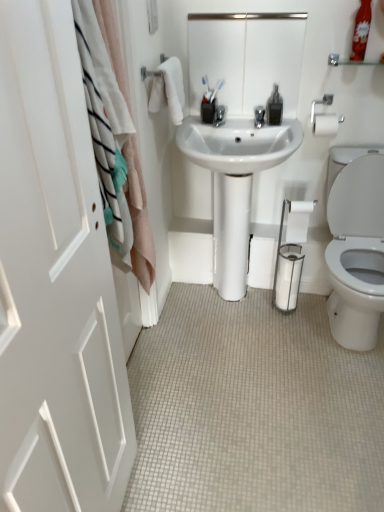
Identify the location of white tile floor at lower center. (253, 409).

This screenshot has height=512, width=384. Describe the element at coordinates (253, 409) in the screenshot. I see `white tile floor at lower center` at that location.

Image resolution: width=384 pixels, height=512 pixels. What do you see at coordinates (55, 282) in the screenshot?
I see `white matte door at left` at bounding box center [55, 282].

This screenshot has height=512, width=384. What do you see at coordinates (139, 218) in the screenshot?
I see `white fabric curtain at left` at bounding box center [139, 218].

The width and height of the screenshot is (384, 512). I want to click on white fabric curtain at left, so click(139, 218).

You are a GUI agent. You are given a task and a screenshot of the screen. Output one action in this format:
    pyautogui.click(x=<x>, y=<y>)
    Task: Click on the white paper roll at lower right
    This screenshot has height=512, width=384.
    Given the screenshot: What is the action you would take?
    pyautogui.click(x=298, y=220)

From a real-world perspective, is white tile floor at lower center under silver metallic towel bar at upper right?

Yes, from a real-world perspective, white tile floor at lower center is beneath silver metallic towel bar at upper right.

Does point (138, 448) appear closer or farther from the camera than point (319, 130)?

Point (138, 448).

Between white tile floor at lower center and silver metallic towel bar at upper right, which one is positioned behind?

silver metallic towel bar at upper right is further away from the camera.

Between white tile floor at lower center and silver metallic towel bar at upper right, which one has less height?

Standing shorter between the two is white tile floor at lower center.

Can you tell me how much white glossy sink at center and silver metallic towel bar at upper right differ in facing direction?

0.283 degrees.

Between white glossy sink at center and silver metallic towel bar at upper right, which one has less height?

Standing shorter between the two is silver metallic towel bar at upper right.

Which of these two, white glossy sink at center or silver metallic towel bar at upper right, is thinner?

Thinner between the two is silver metallic towel bar at upper right.

From a real-world perspective, is clear glass shelf at upper right positioned above or below white matte door at left?

Clearly, from a real-world perspective, clear glass shelf at upper right is above white matte door at left.

Looking at this image, visually, is clear glass shelf at upper right positioned to the left or to the right of white matte door at left?

clear glass shelf at upper right is to the right of white matte door at left.

From the image's perspective, is clear glass shelf at upper right located beneath white matte door at left?

No, from the image's perspective, clear glass shelf at upper right is not beneath white matte door at left.

Is clear glass shelf at upper right oriented away from white matte door at left?

That's not correct — clear glass shelf at upper right is not looking away from white matte door at left.

Is white matte door at left looking in the opposite direction of white fabric curtain at left?

No, white fabric curtain at left is not at the back of white matte door at left.

Can we say white matte door at left lies outside white fabric curtain at left?

That's correct, white matte door at left is outside of white fabric curtain at left.

From the picture: Considering the sizes of objects white matte door at left and white fabric curtain at left in the image provided, who is smaller, white matte door at left or white fabric curtain at left?

white fabric curtain at left is smaller.

Is white matte door at left beside white fabric curtain at left?

No.

From the image's perspective, which one is positioned higher, white matte door at left or silver metallic towel bar at upper right?

silver metallic towel bar at upper right appears higher in the image.

Looking at their sizes, would you say white matte door at left is wider or thinner than silver metallic towel bar at upper right?

white matte door at left is thinner than silver metallic towel bar at upper right.

How different are the orientations of white matte door at left and silver metallic towel bar at upper right in degrees?

They differ by 91.3 degrees in their facing directions.

From a real-world perspective, is white matte door at left above or below silver metallic towel bar at upper right?

Clearly, from a real-world perspective, white matte door at left is below silver metallic towel bar at upper right.

Is silver metallic towel bar at upper right in front of clear plastic bottle at upper right?

No, the depth of silver metallic towel bar at upper right is greater than that of clear plastic bottle at upper right.

Based on the photo, which point is more forward, (331, 99) or (369, 9)?

The point (369, 9) is closer.

From the image's perspective, which is below, silver metallic towel bar at upper right or clear plastic bottle at upper right?

silver metallic towel bar at upper right appears lower in the image.

From a real-world perspective, between silver metallic towel bar at upper right and clear plastic bottle at upper right, who is vertically higher?

From a 3D spatial view, clear plastic bottle at upper right is above.

Considering the sizes of objects white glossy mirror at upper center and silver metallic towel bar at upper right in the image provided, who is thinner, white glossy mirror at upper center or silver metallic towel bar at upper right?

white glossy mirror at upper center.

Where is `mirror on the left side of silver metallic towel bar at upper right`? Image resolution: width=384 pixels, height=512 pixels. mirror on the left side of silver metallic towel bar at upper right is located at coordinates (246, 58).

Between white glossy mirror at upper center and silver metallic towel bar at upper right, which one has smaller size?

silver metallic towel bar at upper right is smaller.

From a real-world perspective, which object stands above the other?

white glossy mirror at upper center.

The height and width of the screenshot is (512, 384). What are the coordinates of `plain located on the left of silver metallic towel bar at upper right` in the screenshot? It's located at (253, 409).

You are a GUI agent. You are given a task and a screenshot of the screen. Output one action in this format:
    pyautogui.click(x=<x>, y=<y>)
    Task: Click on the towel bar on the right of white glossy sink at center
    The width and height of the screenshot is (384, 512).
    Given the screenshot: What is the action you would take?
    pyautogui.click(x=325, y=118)

Which object lies further to the anchor point white soft towel at upper left, clear plastic bottle at upper right or white glossy mirror at upper center?

clear plastic bottle at upper right lies further to white soft towel at upper left than the other object.

Based on their spatial positions, is white soft towel at upper left or white fabric curtain at left further from white glossy mirror at upper center?

white fabric curtain at left lies further to white glossy mirror at upper center than the other object.

From the image, which object appears to be nearer to white soft towel at upper left, white tile floor at lower center or white paper roll at lower right?

Based on the image, white paper roll at lower right appears to be nearer to white soft towel at upper left.

From the image, which object appears to be farther from clear glass shelf at upper right, white tile floor at lower center or white fabric curtain at left?

white tile floor at lower center lies further to clear glass shelf at upper right than the other object.

From the picture: When comparing their distances from white paper roll at lower right, does white glossy sink at center or white fabric curtain at left seem further?

The object further to white paper roll at lower right is white fabric curtain at left.

Looking at the image, which one is located closer to white soft towel at upper left, clear plastic bottle at upper right or white matte door at left?

clear plastic bottle at upper right is positioned closer to the anchor white soft towel at upper left.

Based on their spatial positions, is white glossy mirror at upper center or white glossy sink at center closer to white matte door at left?

Among the two, white glossy sink at center is located nearer to white matte door at left.

From the image, which object appears to be farther from clear glass shelf at upper right, clear plastic bottle at upper right or white paper roll at lower right?

white paper roll at lower right is further to clear glass shelf at upper right.

Find the location of a particular element. sink between white soft towel at upper left and white paper roll at lower right in the vertical direction is located at coordinates (235, 185).

The image size is (384, 512). Identify the location of sink between white matte door at left and white glossy mirror at upper center from front to back. (235, 185).

At what (x,y) coordinates should I click in order to perform the action: click on mirror between white soft towel at upper left and clear glass shelf at upper right from left to right. Please return your answer as a coordinate pair (x, y). Looking at the image, I should click on (246, 58).

Locate an element on the screen. The width and height of the screenshot is (384, 512). toilet paper situated between white soft towel at upper left and silver metallic towel bar at upper right from left to right is located at coordinates (298, 220).